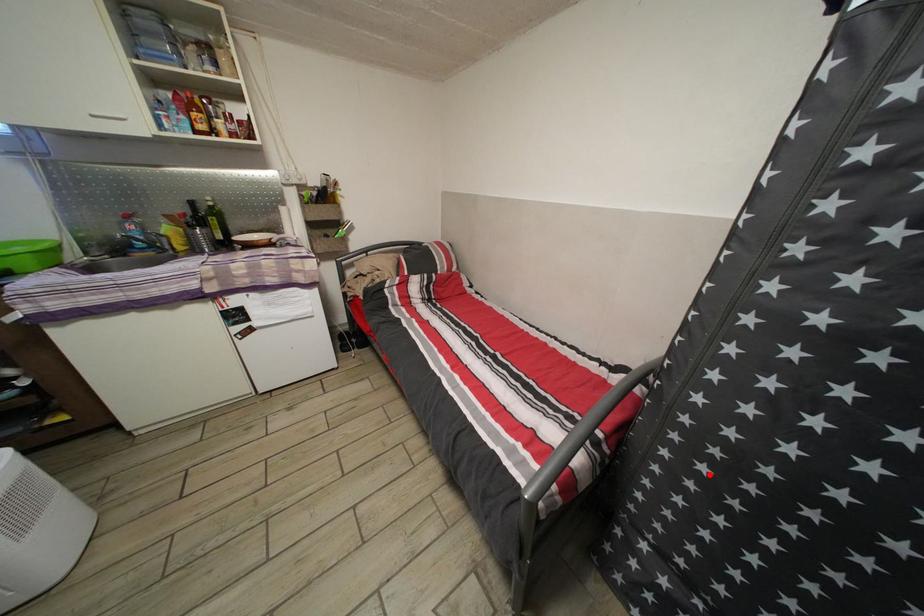
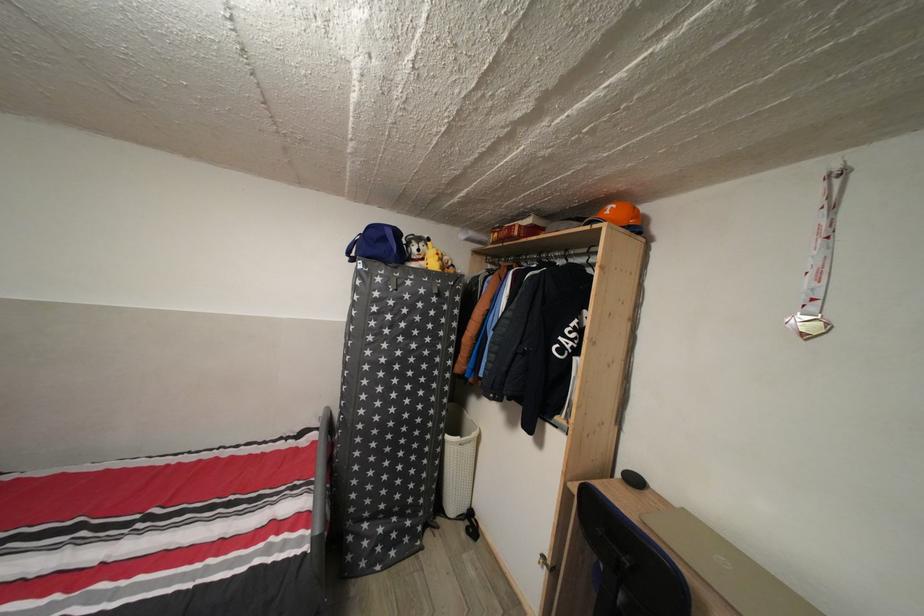
Where in the second image is the point corresponding to the highlighted location from the first image?

(380, 451)